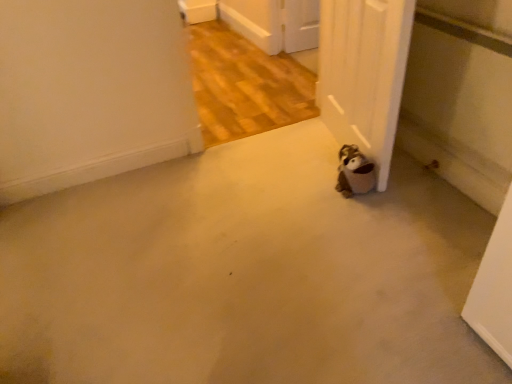
Find the location of `free space in front of brown plush toy at lower right`. free space in front of brown plush toy at lower right is located at coordinates (364, 215).